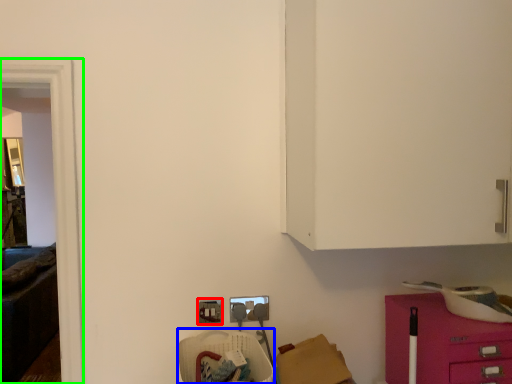
Question: Considering the real-world distances, which object is closest to electric outlet (highlighted by a red box)? armchair (highlighted by a blue box) or glass door (highlighted by a green box).

Choices:
 (A) armchair
 (B) glass door

Answer: (A)